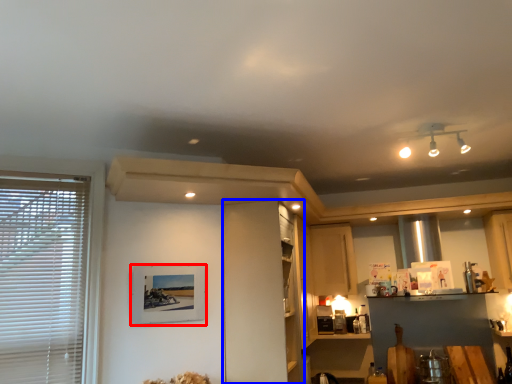
Question: Which of the following is the farthest to the observer, picture frame (highlighted by a red box) or cabinetry (highlighted by a blue box)?

Choices:
 (A) picture frame
 (B) cabinetry

Answer: (B)